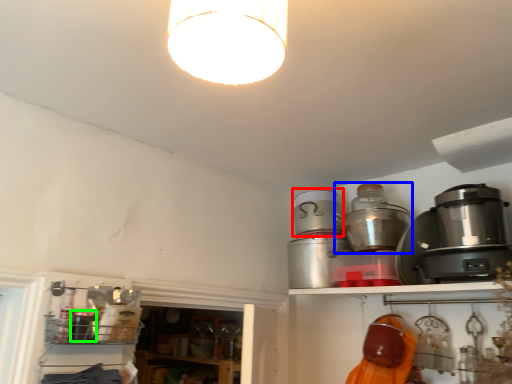
Question: Which object is the farthest from appliance (highlighted by a red box)? Choose among these: appliance (highlighted by a blue box) or appliance (highlighted by a green box).

Choices:
 (A) appliance
 (B) appliance

Answer: (B)